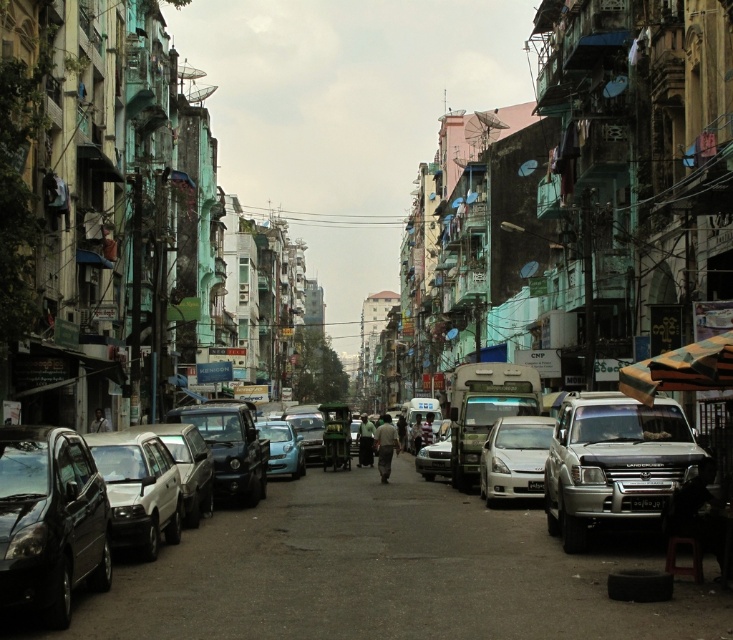
Question: Which object appears farthest from the camera in this image?

Choices:
 (A) matte blue car at center
 (B) matte black car at left
 (C) white plastic license plate at center

Answer: (A)

Question: Which point is farther from the camera taking this photo?

Choices:
 (A) coord(259,465)
 (B) coord(128,541)
 (C) coord(361,451)

Answer: (C)

Question: Is silver metallic suv at right above dark green fabric at center?

Choices:
 (A) no
 (B) yes

Answer: (B)

Question: Based on their relative distances, which object is farther from the shiny black car at left?

Choices:
 (A) matte blue car at center
 (B) silver metallic suv at right
 (C) satin silver sedan at center

Answer: (A)

Question: Is shiny black car at center wider than dark gray fabric person at center?

Choices:
 (A) yes
 (B) no

Answer: (A)

Question: Is shiny black car at left above dark gray fabric person at center?

Choices:
 (A) no
 (B) yes

Answer: (B)